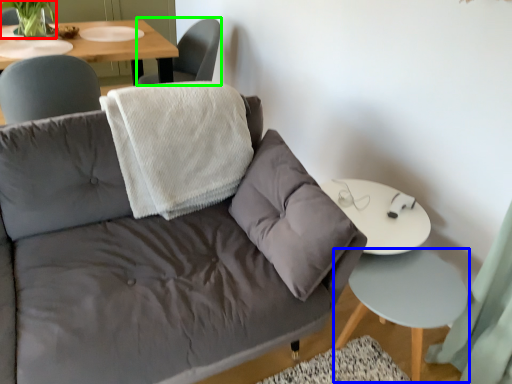
Question: Which object is the closest to the plant (highlighted by a red box)? Choose among these: side table (highlighted by a blue box) or chair (highlighted by a green box).

Choices:
 (A) side table
 (B) chair

Answer: (B)